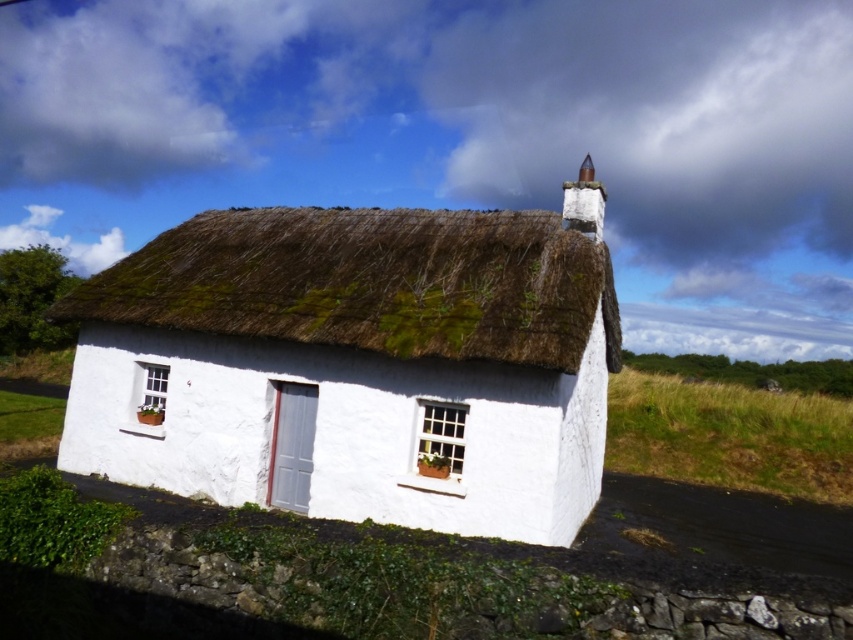
Can you confirm if white thatch roof at center is taller than green thatch at center?

Yes, white thatch roof at center is taller than green thatch at center.

Is point (108, 276) positioned after point (200, 272)?

Yes, point (108, 276) is behind point (200, 272).

Is point (196, 243) positioned in front of point (276, 326)?

No, (196, 243) is behind (276, 326).

Where is `white thatch roof at center`? This screenshot has height=640, width=853. white thatch roof at center is located at coordinates (357, 364).